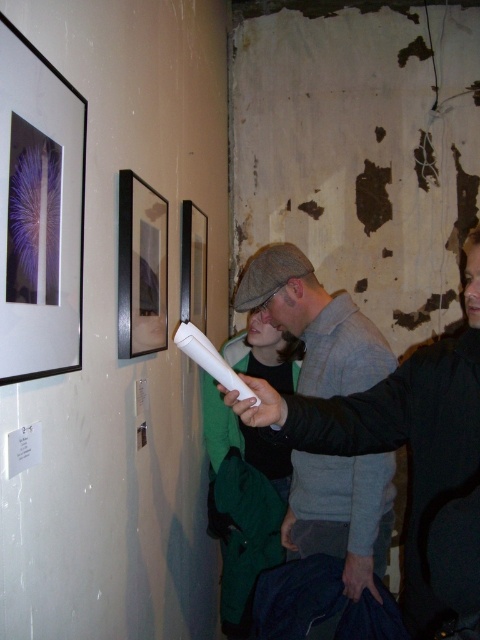
Question: Which of these objects is positioned farthest from the black wood picture frame at center?

Choices:
 (A) white matte wii remote at center
 (B) black glossy picture frame at upper center
 (C) matte black picture frame at upper left
 (D) matte gray cap at center

Answer: (D)

Question: Does matte black picture frame at upper left appear under white matte wii remote at center?

Choices:
 (A) no
 (B) yes

Answer: (A)

Question: From the image, what is the correct spatial relationship of matte black picture frame at upper left in relation to matte gray cap at center?

Choices:
 (A) above
 (B) below

Answer: (A)

Question: Based on their relative distances, which object is nearer to the white matte wii remote at center?

Choices:
 (A) black glossy picture frame at upper center
 (B) black wood picture frame at center
 (C) matte gray cap at center
 (D) matte black picture frame at upper left

Answer: (D)

Question: Where is black wood picture frame at center located in relation to black glossy picture frame at upper center in the image?

Choices:
 (A) left
 (B) right

Answer: (A)

Question: Which object appears closest to the camera in this image?

Choices:
 (A) matte black picture frame at upper left
 (B) black glossy picture frame at upper center

Answer: (A)